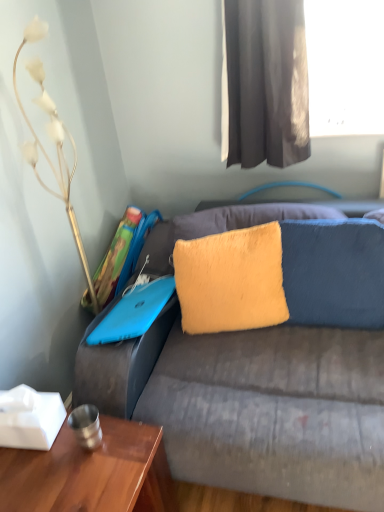
Identify the location of empty space that is ontop of wooden table at lower left (from a real-world perspective). (61, 462).